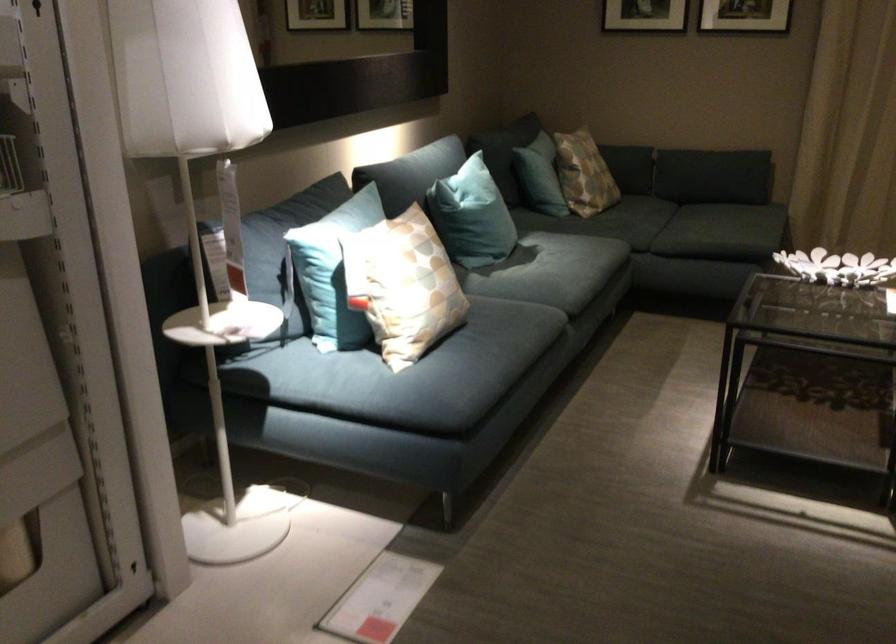
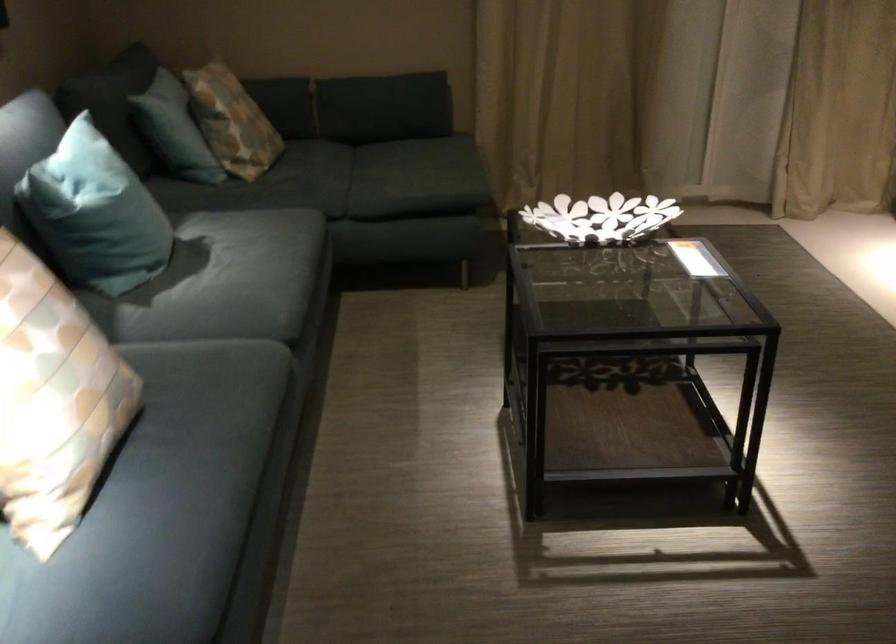
Find the pixel in the second image that matches [487,342] in the first image.

(197, 436)